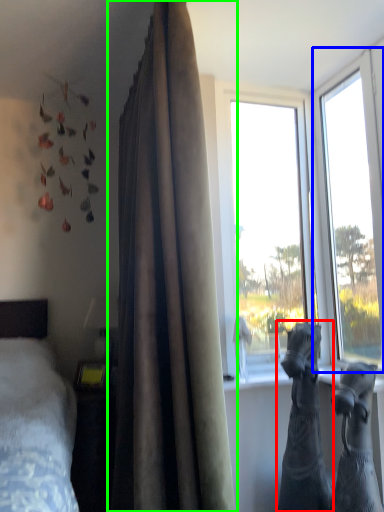
Question: Considering the real-world distances, which object is farthest from animal (highlighted by a red box)? window (highlighted by a blue box) or curtain (highlighted by a green box)?

Choices:
 (A) window
 (B) curtain

Answer: (A)